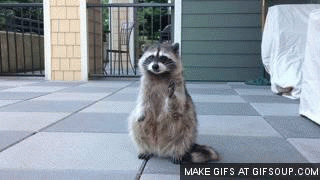
Where is `green wall`? This screenshot has width=320, height=180. green wall is located at coordinates (212, 31).